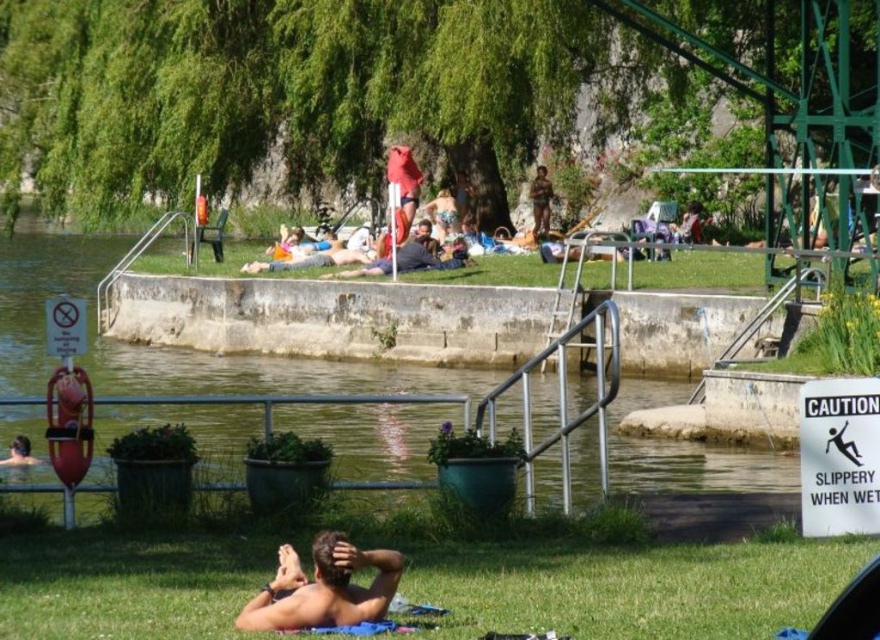
Question: Which object appears closest to the camera in this image?

Choices:
 (A) dark gray fabric shirt at center
 (B) brown textured shorts at center
 (C) green concrete river at center
 (D) smooth skin man at lower center

Answer: (D)

Question: Does green grass at center come in front of brown textured shorts at center?

Choices:
 (A) yes
 (B) no

Answer: (A)

Question: Can you confirm if green concrete river at center is positioned to the left of brown textured shorts at center?

Choices:
 (A) no
 (B) yes

Answer: (B)

Question: Is smooth skin man at lower center above brown textured shorts at center?

Choices:
 (A) yes
 (B) no

Answer: (B)

Question: Which object appears closest to the camera in this image?

Choices:
 (A) green grass at lower center
 (B) smooth skin man at lower center
 (C) green concrete river at center
 (D) brown textured shorts at center

Answer: (B)

Question: Which is farther from the green concrete river at center?

Choices:
 (A) green grass at center
 (B) brown textured shorts at center
 (C) green grass at lower center
 (D) dark gray fabric shirt at center

Answer: (B)